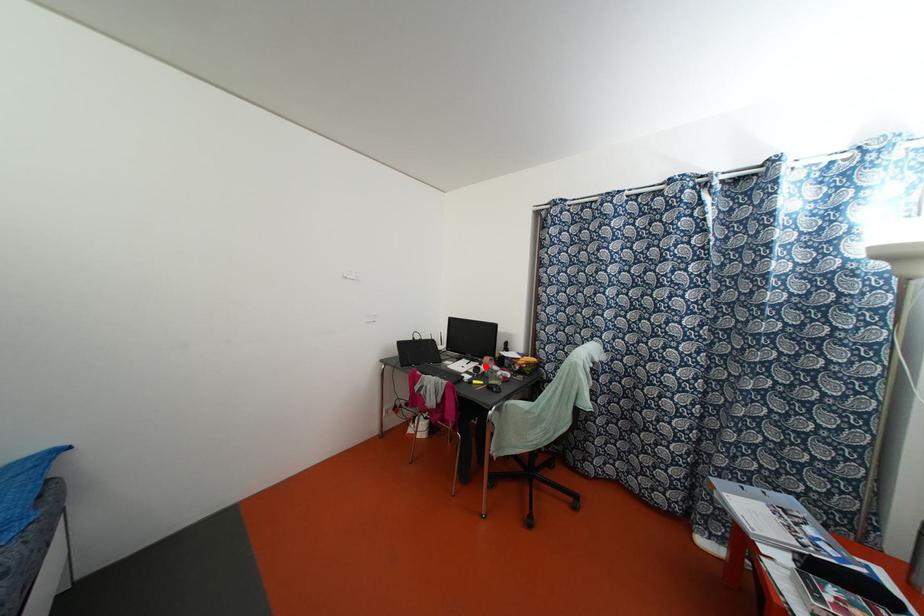
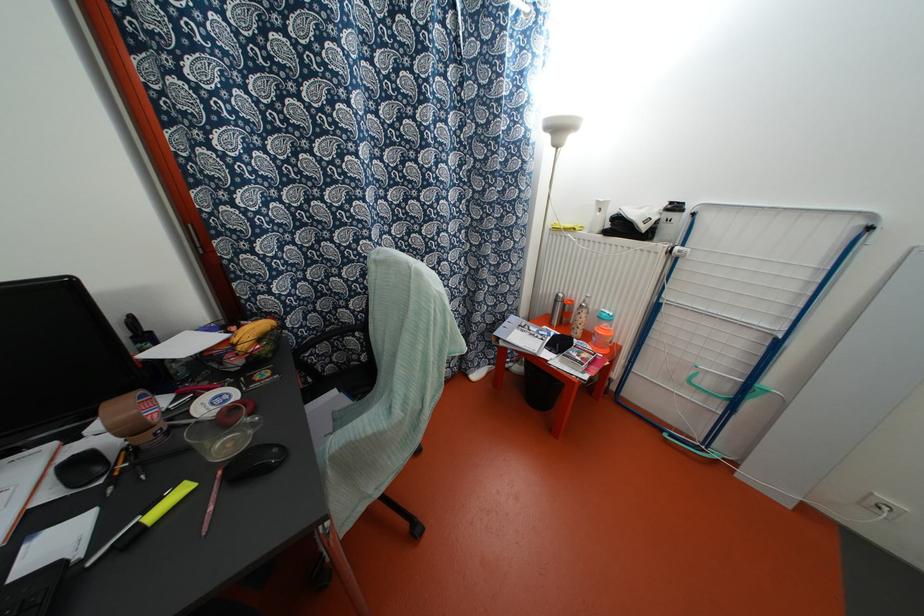
Question: I am providing you with two images of the same scene from different viewpoints. Image1 has a red point marked. In image2, the corresponding 3D location appears at what relative position? Reply with the corresponding letter.

Choices:
 (A) Closer
 (B) Farther

Answer: (A)